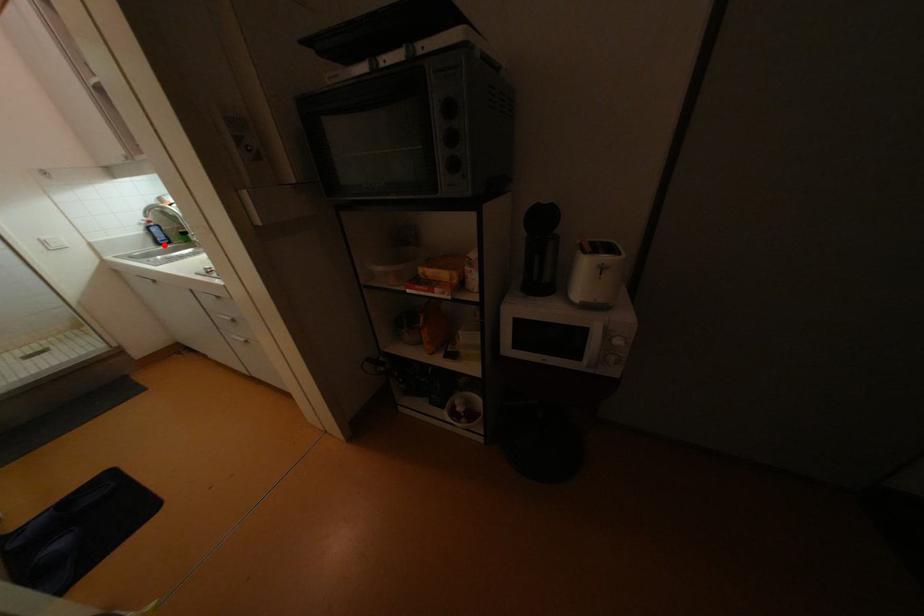
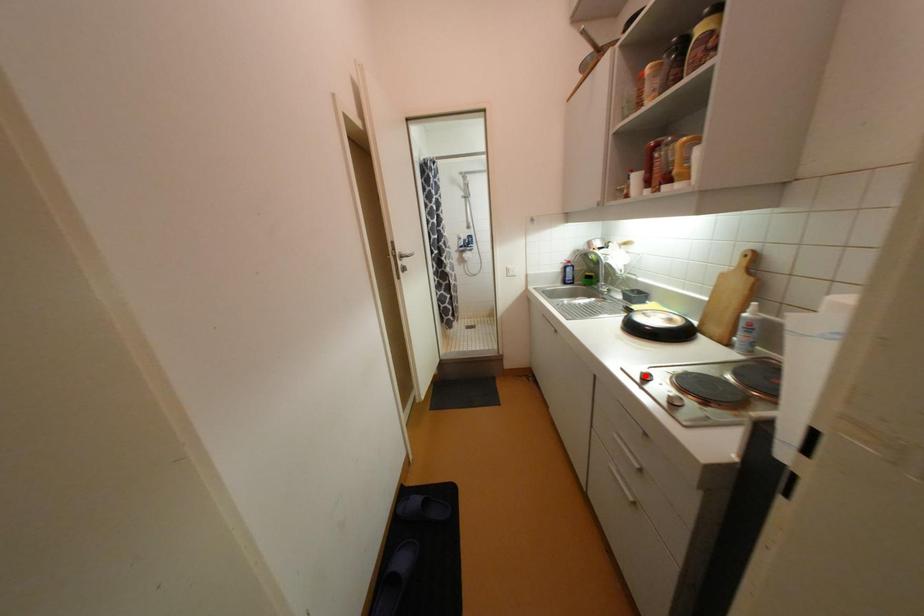
I am providing you with two images of the same scene from different viewpoints. A red point is marked on the first image and another point is marked on the second image. Are the points marked in image1 and image2 representing the same 3D position?

No